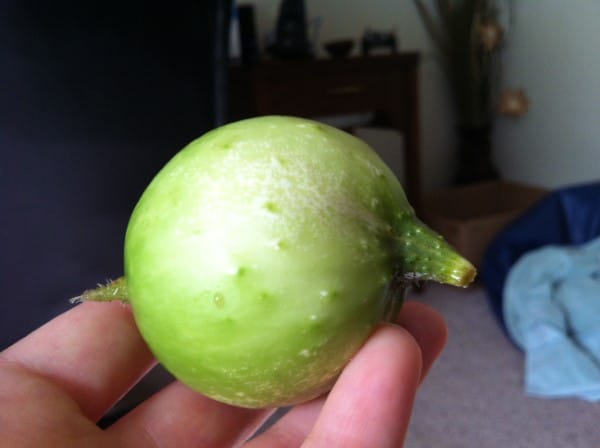
Identify the location of plant. (182, 233).